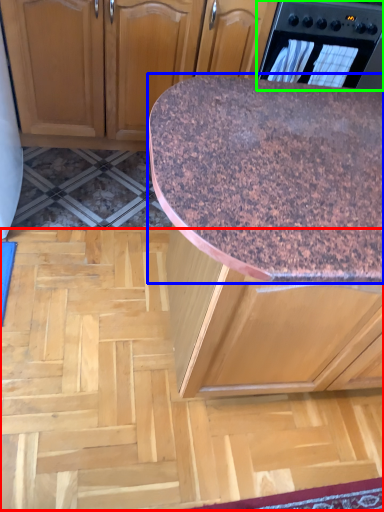
Question: Which is farther away from plywood (highlighted by a red box)? countertop (highlighted by a blue box) or home appliance (highlighted by a green box)?

Choices:
 (A) countertop
 (B) home appliance

Answer: (B)